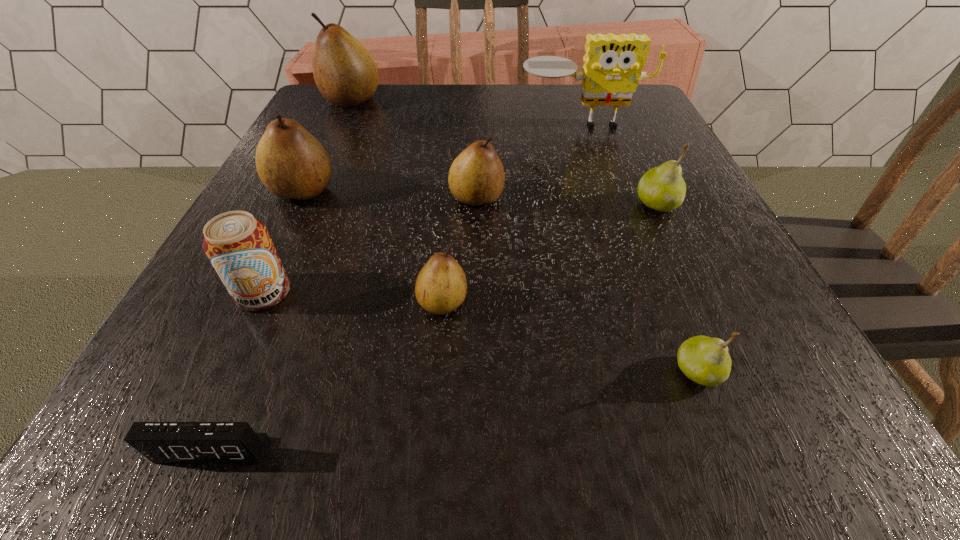
Where is `the nearest pear`? the nearest pear is located at coordinates (706, 361).

This screenshot has height=540, width=960. I want to click on the nearest object, so click(x=160, y=442).

I want to click on alarm clock, so click(x=160, y=442).

Identify the location of free spot located on the right of the farthest brown pear. This screenshot has width=960, height=540. (401, 100).

The width and height of the screenshot is (960, 540). What are the coordinates of `free space located on the front-facing side of the sponge` in the screenshot? It's located at (628, 256).

Find the location of a particular element. The image size is (960, 540). free space located 0.160m on the right of the fifth shortest pear is located at coordinates pos(422,191).

What are the coordinates of `free location located 0.100m on the back of the bigger green pear` in the screenshot? It's located at (637, 163).

Find the location of `free space located on the back of the second smallest brown pear`. free space located on the back of the second smallest brown pear is located at coordinates (477, 98).

You are a GUI agent. You are given a task and a screenshot of the screen. Output one action in this format:
    pyautogui.click(x=<x>, y=<y>)
    Task: Click on the blank area located 0.170m on the front of the beer can
    The height and width of the screenshot is (540, 960).
    Given the screenshot: What is the action you would take?
    pyautogui.click(x=201, y=430)

You are a GUI agent. You are given a task and a screenshot of the screen. Output one action in this format:
    pyautogui.click(x=<x>, y=<y>)
    Task: Click on the free spot located 0.310m on the left of the smallest brown pear
    
    Given the screenshot: What is the action you would take?
    click(x=201, y=302)